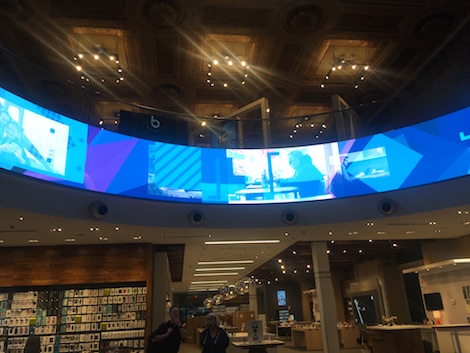
I want to click on pillar, so click(x=326, y=295), click(x=253, y=299).